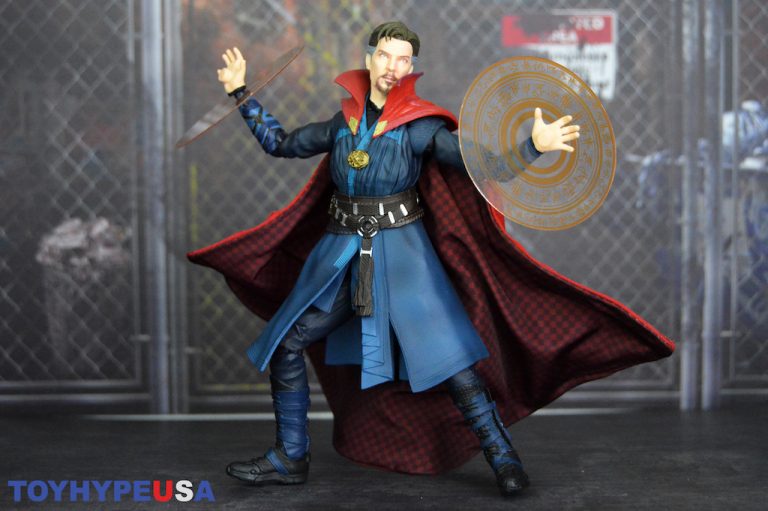
Where is `dr strange figurine`? dr strange figurine is located at coordinates (382, 179).